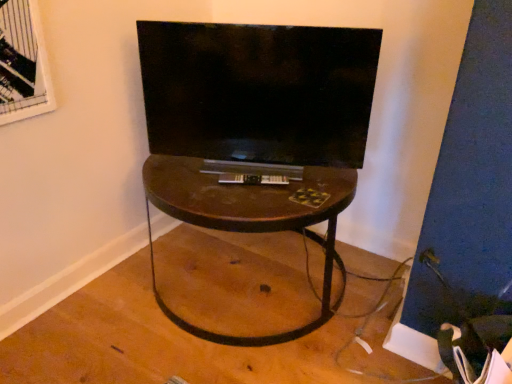
Question: Does brown wood table at center appear on the left side of velvet black swivel chair at lower right?

Choices:
 (A) yes
 (B) no

Answer: (A)

Question: Is brown wood table at center looking in the opposite direction of velvet black swivel chair at lower right?

Choices:
 (A) yes
 (B) no

Answer: (B)

Question: Is velvet black swivel chair at lower right completely or partially inside brown wood table at center?

Choices:
 (A) no
 (B) yes

Answer: (A)

Question: Does brown wood table at center have a lesser width compared to velvet black swivel chair at lower right?

Choices:
 (A) no
 (B) yes

Answer: (A)

Question: Is brown wood table at center at the right side of velvet black swivel chair at lower right?

Choices:
 (A) yes
 (B) no

Answer: (B)

Question: Is brown wood table at center behind velvet black swivel chair at lower right?

Choices:
 (A) yes
 (B) no

Answer: (A)

Question: Considering the relative sizes of velvet black swivel chair at lower right and brown wood table at center in the image provided, is velvet black swivel chair at lower right thinner than brown wood table at center?

Choices:
 (A) no
 (B) yes

Answer: (B)

Question: Is the surface of velvet black swivel chair at lower right in direct contact with brown wood table at center?

Choices:
 (A) no
 (B) yes

Answer: (A)

Question: Considering the relative sizes of velvet black swivel chair at lower right and brown wood table at center in the image provided, is velvet black swivel chair at lower right smaller than brown wood table at center?

Choices:
 (A) no
 (B) yes

Answer: (B)

Question: From the image's perspective, is velvet black swivel chair at lower right beneath brown wood table at center?

Choices:
 (A) yes
 (B) no

Answer: (A)

Question: From the image's perspective, is velvet black swivel chair at lower right above brown wood table at center?

Choices:
 (A) no
 (B) yes

Answer: (A)

Question: Can you confirm if velvet black swivel chair at lower right is positioned to the left of brown wood table at center?

Choices:
 (A) no
 (B) yes

Answer: (A)

Question: Can you confirm if matte black tv at center is positioned to the left of velvet black swivel chair at lower right?

Choices:
 (A) no
 (B) yes

Answer: (B)